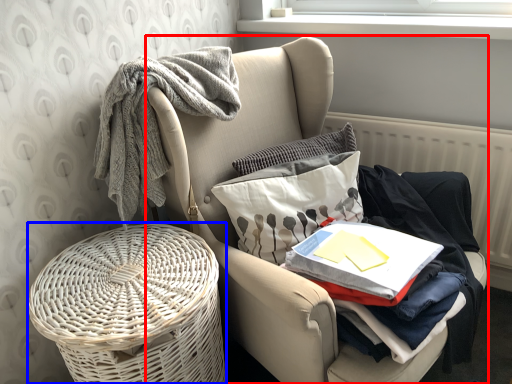
Question: Which of the following is the closest to the observer, chair (highlighted by a red box) or basket container (highlighted by a blue box)?

Choices:
 (A) chair
 (B) basket container

Answer: (A)